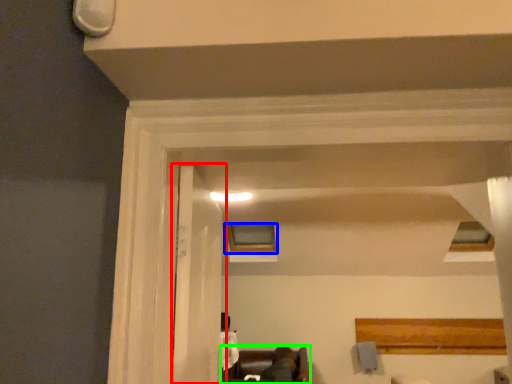
Question: Which is farther away from door (highlighted by a red box)? window (highlighted by a blue box) or furniture (highlighted by a green box)?

Choices:
 (A) window
 (B) furniture

Answer: (A)